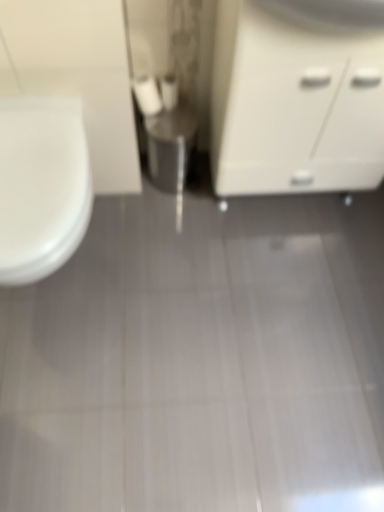
The width and height of the screenshot is (384, 512). Find the location of `blank space to the left of white matte cabinet at right`. blank space to the left of white matte cabinet at right is located at coordinates (166, 226).